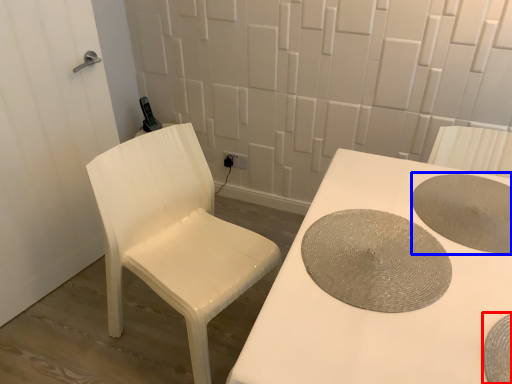
Question: Which of the following is the farthest to the observer, manhole cover (highlighted by a red box) or manhole cover (highlighted by a blue box)?

Choices:
 (A) manhole cover
 (B) manhole cover

Answer: (B)